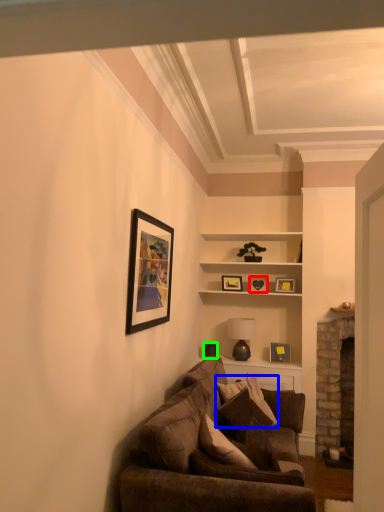
Question: Which object is positioned farthest from picture frame (highlighted by a red box)? Select from pillow (highlighted by a blue box) and picture frame (highlighted by a green box).

Choices:
 (A) pillow
 (B) picture frame

Answer: (A)